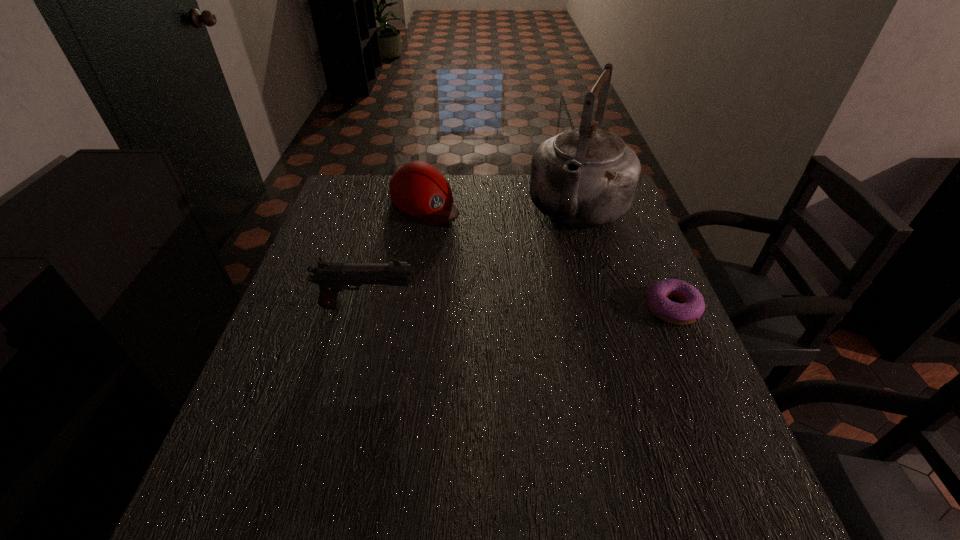
Locate an element on the screen. The height and width of the screenshot is (540, 960). blank region between the tallest object and the shortest object is located at coordinates (626, 258).

The height and width of the screenshot is (540, 960). I want to click on free spot between the kettle and the second tallest object, so click(x=474, y=258).

This screenshot has height=540, width=960. I want to click on vacant space that's between the kettle and the baseball cap, so click(502, 206).

Select which object is the third closest to the second shortest object. Please provide its 2D coordinates. Your answer should be formatted as a tuple, i.e. [(x, y)], where the tuple contains the x and y coordinates of a point satisfying the conditions above.

[(692, 306)]

Locate an element on the screen. The width and height of the screenshot is (960, 540). object that is the second nearest to the tallest object is located at coordinates (418, 189).

Locate an element on the screen. The height and width of the screenshot is (540, 960). free space that satisfies the following two spatial constraints: 1. on the front side of the kettle; 2. on the right side of the doughnut is located at coordinates (609, 307).

The image size is (960, 540). In order to click on vacant space that satisfies the following two spatial constraints: 1. on the front side of the doughnut; 2. on the right side of the third tallest object in this screenshot , I will do `click(407, 307)`.